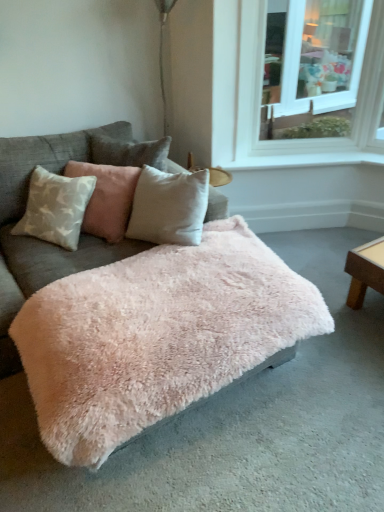
Question: Is fuzzy pink ottoman at center to the left of fuzzy pink blanket at center from the viewer's perspective?

Choices:
 (A) yes
 (B) no

Answer: (B)

Question: Is fuzzy pink ottoman at center next to fuzzy pink blanket at center?

Choices:
 (A) no
 (B) yes

Answer: (A)

Question: From a real-world perspective, is fuzzy pink ottoman at center located higher than fuzzy pink blanket at center?

Choices:
 (A) no
 (B) yes

Answer: (A)

Question: Can you confirm if fuzzy pink ottoman at center is taller than fuzzy pink blanket at center?

Choices:
 (A) yes
 (B) no

Answer: (B)

Question: Is fuzzy pink ottoman at center wider than fuzzy pink blanket at center?

Choices:
 (A) yes
 (B) no

Answer: (A)

Question: In terms of height, does white glass window at upper right look taller or shorter compared to white smooth window sill at upper right?

Choices:
 (A) tall
 (B) short

Answer: (A)

Question: Would you say white glass window at upper right is to the left or to the right of white smooth window sill at upper right in the picture?

Choices:
 (A) left
 (B) right

Answer: (B)

Question: In terms of width, does white glass window at upper right look wider or thinner when compared to white smooth window sill at upper right?

Choices:
 (A) wide
 (B) thin

Answer: (B)

Question: From the image's perspective, is white glass window at upper right positioned above or below white smooth window sill at upper right?

Choices:
 (A) above
 (B) below

Answer: (A)

Question: Is white smooth window sill at upper right taller or shorter than velvet beige pillow at center?

Choices:
 (A) short
 (B) tall

Answer: (A)

Question: In terms of size, does white smooth window sill at upper right appear bigger or smaller than velvet beige pillow at center?

Choices:
 (A) big
 (B) small

Answer: (B)

Question: Choose the correct answer: Is white smooth window sill at upper right inside velvet beige pillow at center or outside it?

Choices:
 (A) inside
 (B) outside

Answer: (B)

Question: Considering the positions of point (261, 165) and point (107, 237), is point (261, 165) closer or farther from the camera than point (107, 237)?

Choices:
 (A) farther
 (B) closer

Answer: (A)

Question: From the image's perspective, is white smooth window sill at upper right positioned above or below fuzzy pink blanket at center?

Choices:
 (A) below
 (B) above

Answer: (B)

Question: Based on their sizes in the image, would you say white smooth window sill at upper right is bigger or smaller than fuzzy pink blanket at center?

Choices:
 (A) big
 (B) small

Answer: (B)